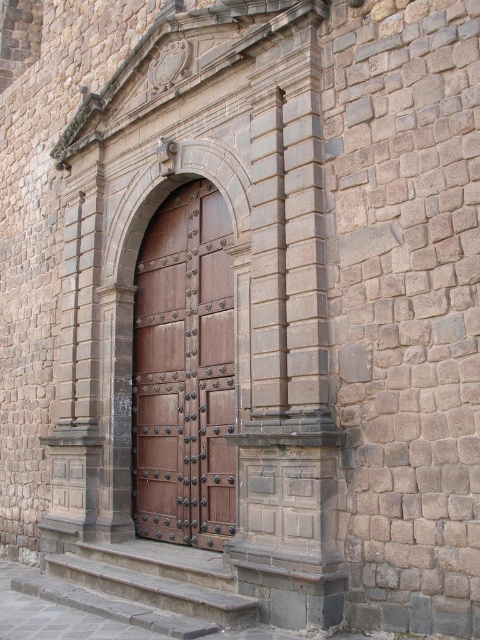
Based on the photo, does brown polished wood door at center have a smaller size compared to gray stone steps at lower center?

No.

Is point (201, 289) closer to camera compared to point (180, 557)?

No.

Image resolution: width=480 pixels, height=640 pixels. What are the coordinates of `brown polished wood door at center` in the screenshot? It's located at (183, 372).